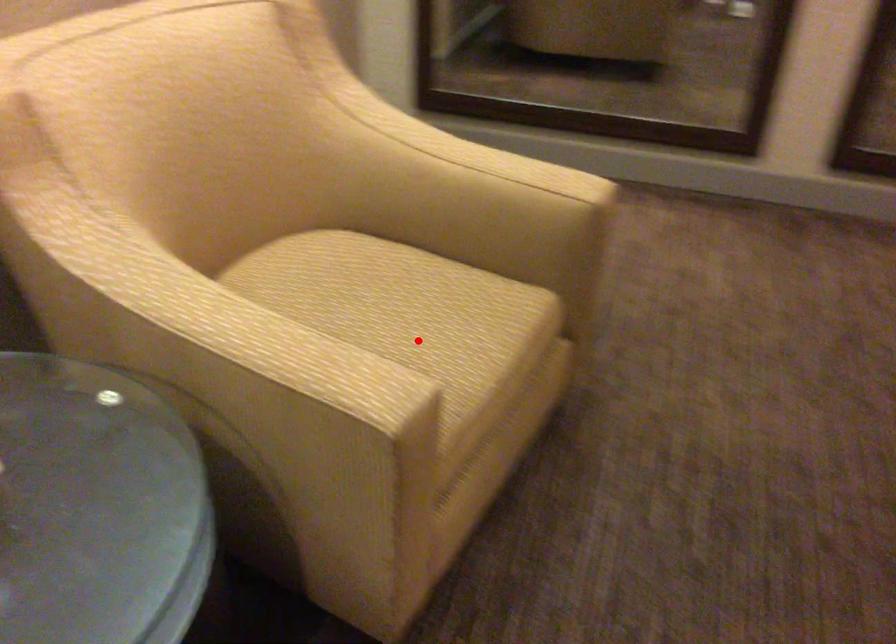
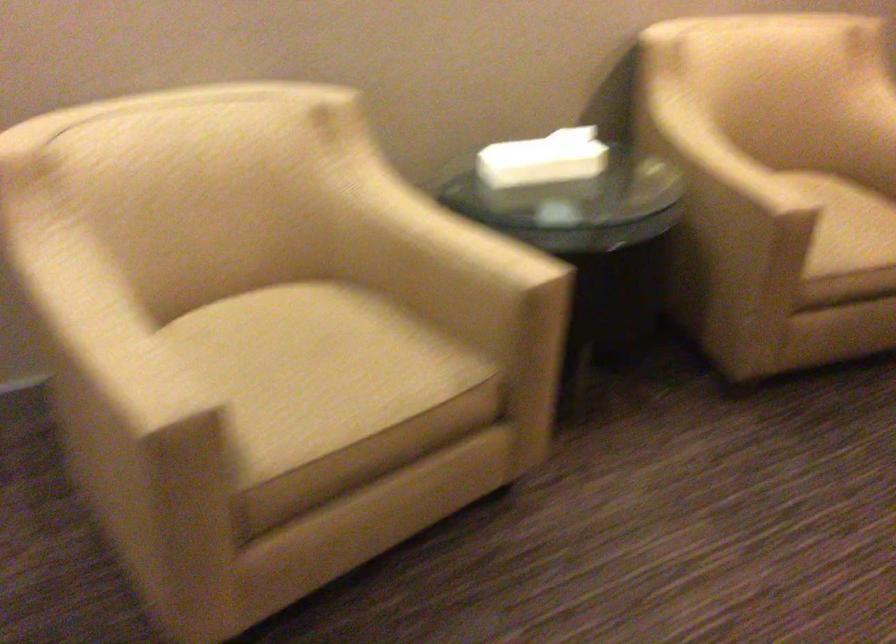
Find the pixel in the second image that matches the highlighted location in the first image.

(846, 225)